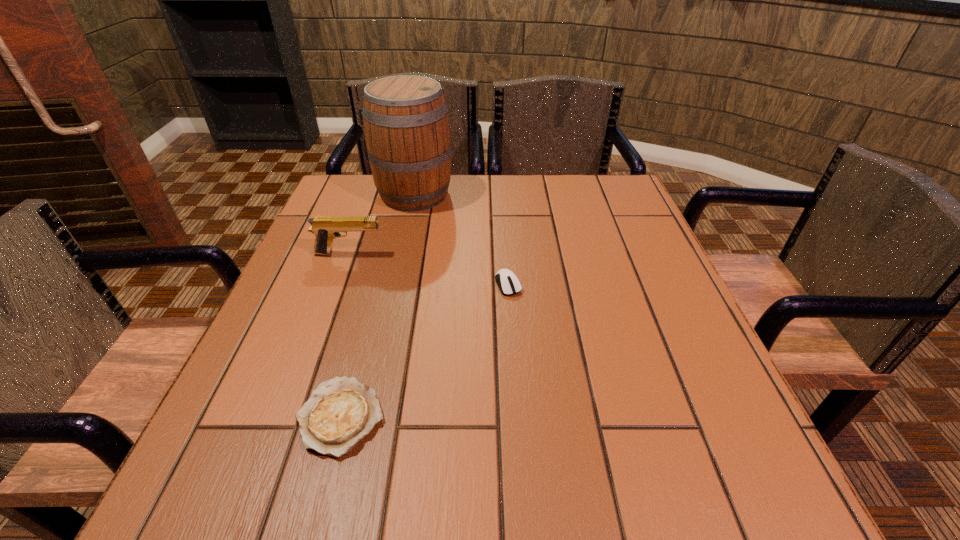
I want to click on the tallest object, so click(x=406, y=126).

Locate an element on the screen. The image size is (960, 540). cider is located at coordinates (406, 126).

Where is `pistol`? The width and height of the screenshot is (960, 540). pistol is located at coordinates (326, 228).

At what (x,y) coordinates should I click in order to perform the action: click on the third nearest object. Please return your answer as a coordinate pair (x, y). Looking at the image, I should click on (326, 228).

Find the location of a particular element. Image resolution: width=960 pixels, height=540 pixels. the rightmost object is located at coordinates (508, 283).

What are the coordinates of `mouse` in the screenshot? It's located at (508, 283).

What are the coordinates of `the nearest object` in the screenshot? It's located at (341, 412).

In order to click on quiche in this screenshot , I will do `click(341, 412)`.

Identify the location of vacant space situated 0.370m on the front of the cider. (387, 319).

Identify the location of vacant position located 0.170m at the barrel of the second tallest object. (458, 254).